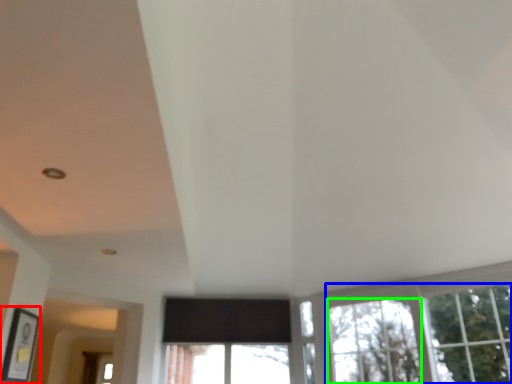
Question: Based on their relative distances, which object is farther from picture frame (highlighted by a red box)? Choose from tree (highlighted by a blue box) and window (highlighted by a green box).

Choices:
 (A) tree
 (B) window

Answer: (A)